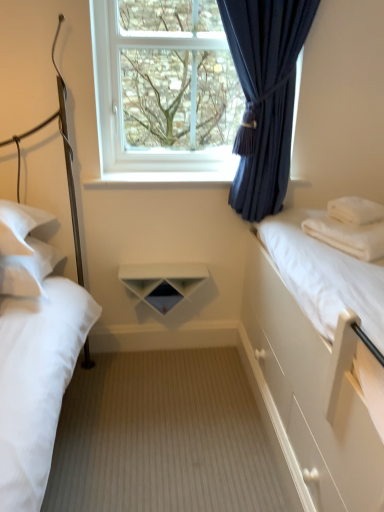
Image resolution: width=384 pixels, height=512 pixels. I want to click on empty space that is ontop of white glossy shelf at center (from a real-world perspective), so click(x=176, y=170).